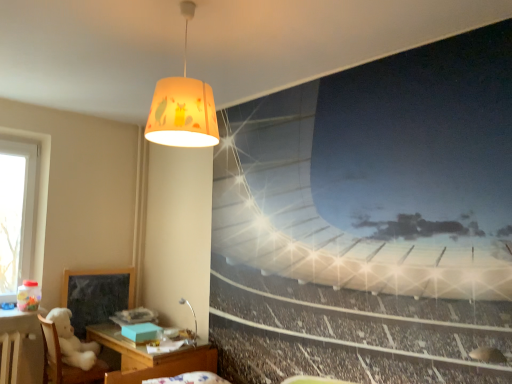
This screenshot has width=512, height=384. What are the coordinates of `empty space that is ontop of matte yellow fabric lampshade at upper center, the second lamp positioned from the back` in the screenshot? It's located at (187, 11).